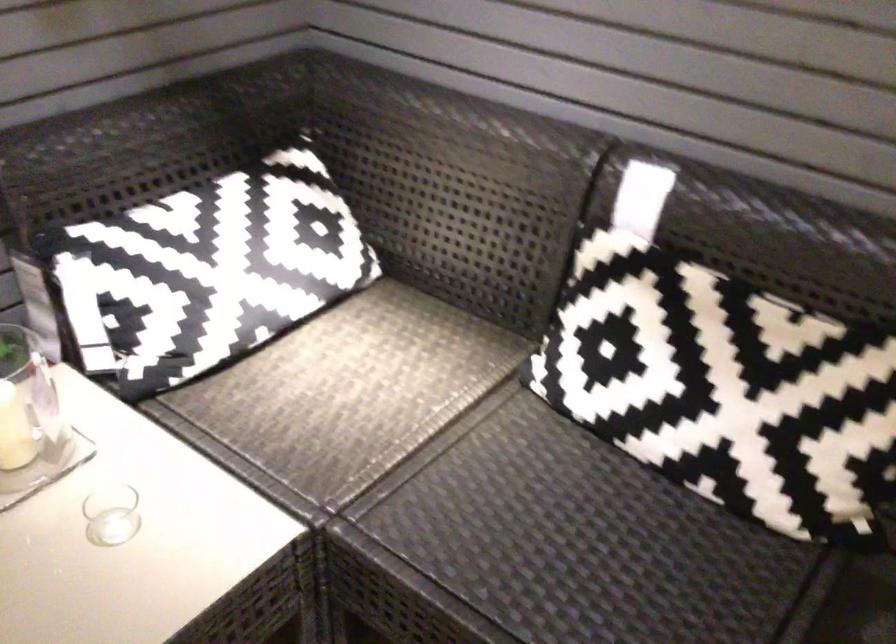
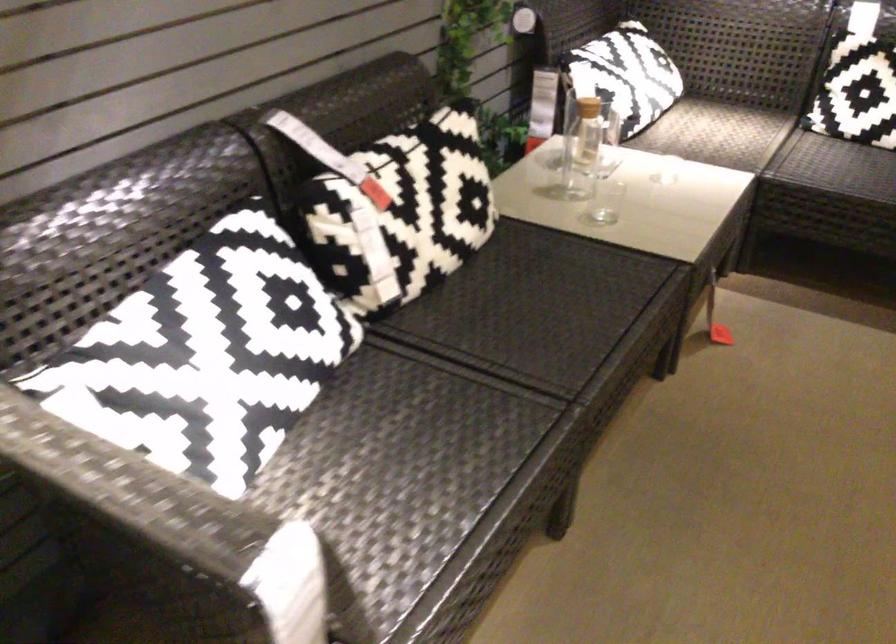
What movement of the cameraman would produce the second image?

The cameraman walked toward left, backward.